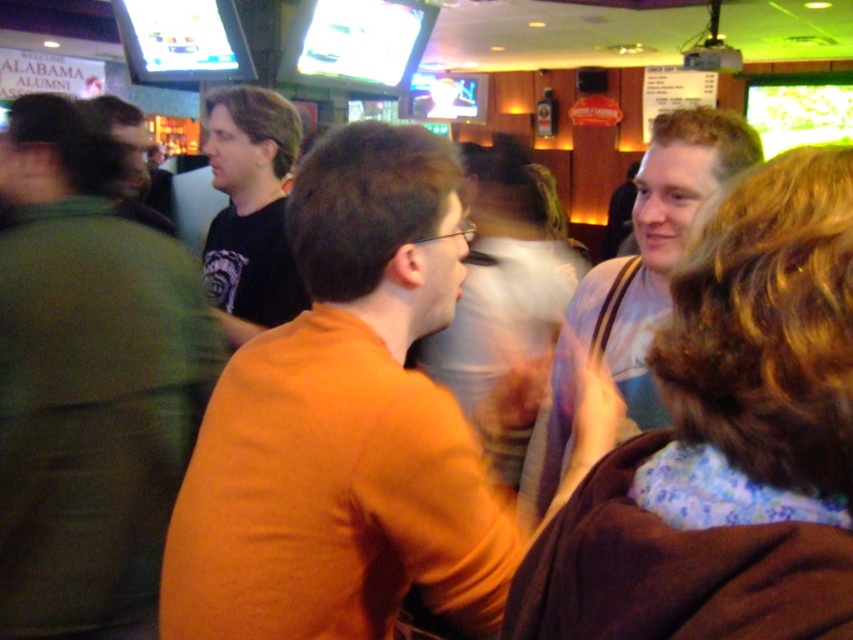
You are a photographer trying to capture a candid shot of both the orange matte shirt at center and the dark brown hair at left. Since you want to ensure both subjects are clearly visible in the frame, which subject should you focus on first to account for their size differences?

The orange matte shirt at center is smaller than the dark brown hair at left. To ensure both are clearly visible, focus on the dark brown hair at left first since it is larger and might require more attention to capture details.

You are a photographer trying to capture a group photo of the green cotton shirt at left and the white cotton shirt at upper right. If you want to ensure both shirts are clearly visible in the frame, which shirt should you position closer to the camera?

The green cotton shirt at left is wider than the white cotton shirt at upper right, so to ensure both are clearly visible, position the green cotton shirt at left closer to the camera since its larger size may require more focus.

You are at a social event and want to greet both the green cotton shirt at left and the white cotton shirt at upper right. Which direction should you move first to approach the one closer to your current position?

The green cotton shirt at left is to the left of the white cotton shirt at upper right, so you should move towards the left first to approach the green cotton shirt at left since it is closer to your current position.